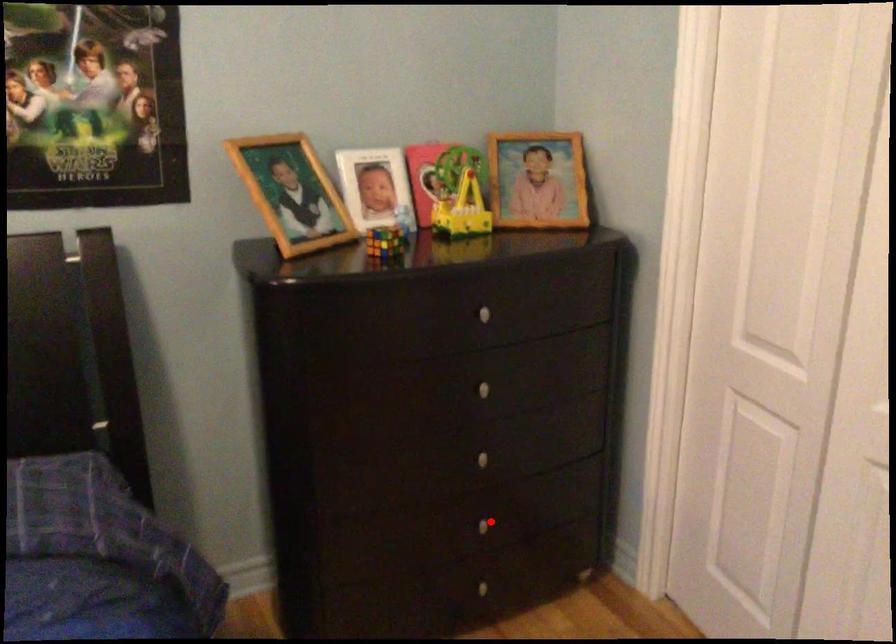
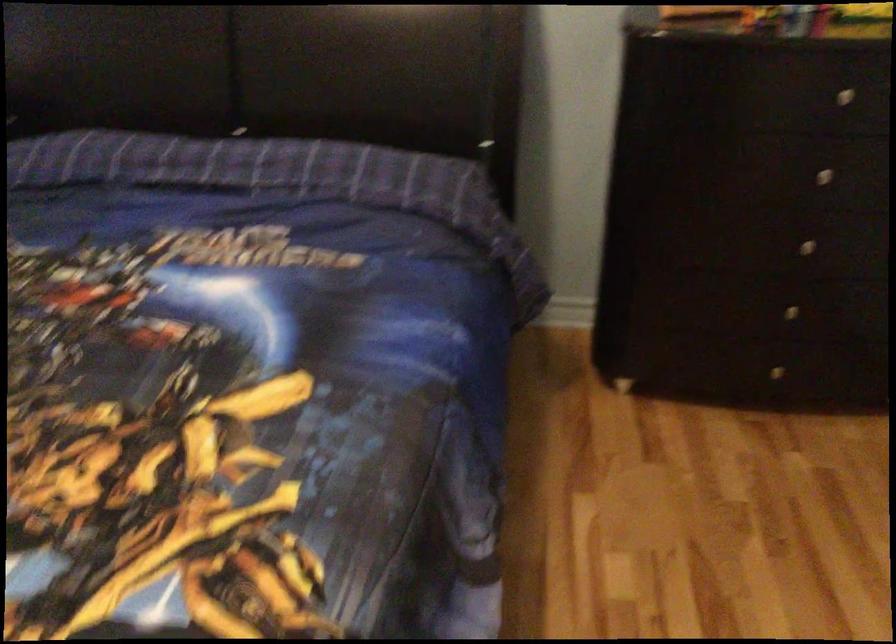
In the second image, find the point that corresponds to the highlighted location in the first image.

(790, 310)